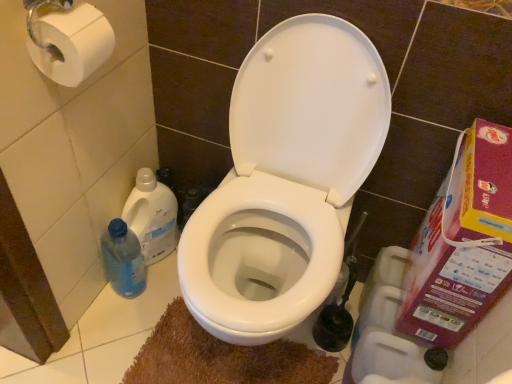
In order to click on free spot in front of translucent plastic bottle at lower left, arranged as the 2th cleaning product when ordered from the bottom in this screenshot , I will do `click(135, 305)`.